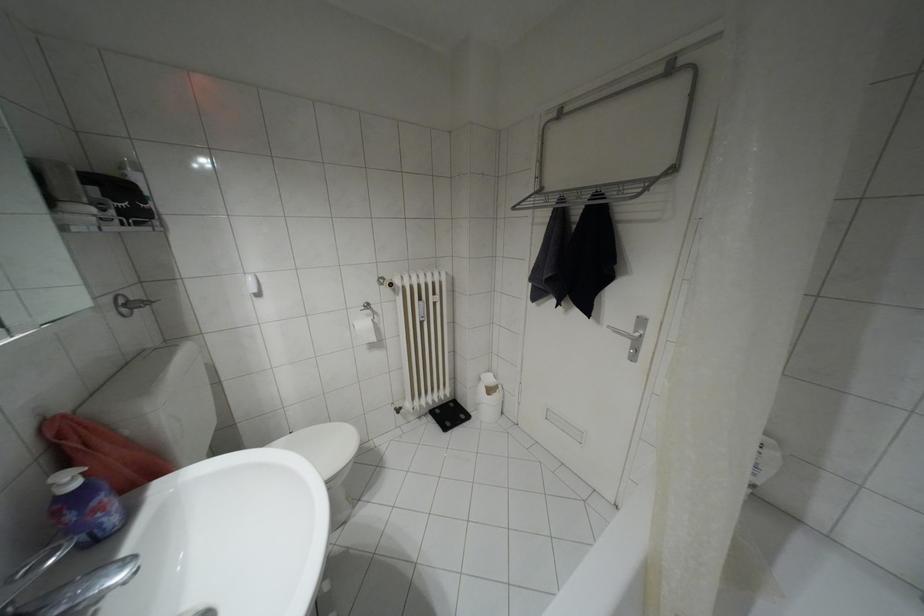
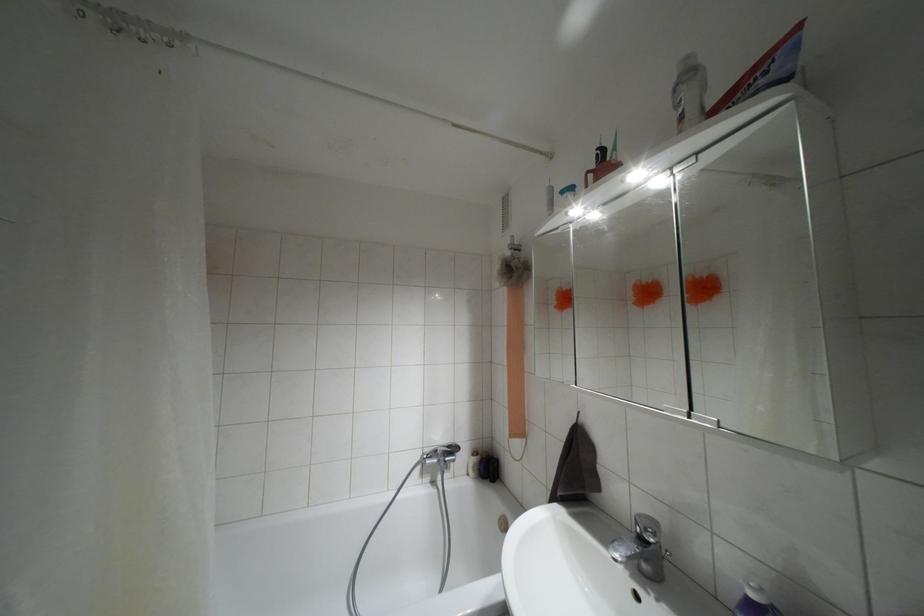
In the second image, find the point that corresponds to the point at 75,484 in the first image.

(751, 594)